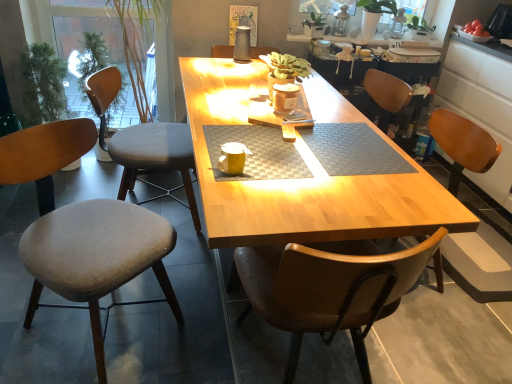
This screenshot has height=384, width=512. Identify the location of free point behind yellow matte coffee cup at center. (240, 146).